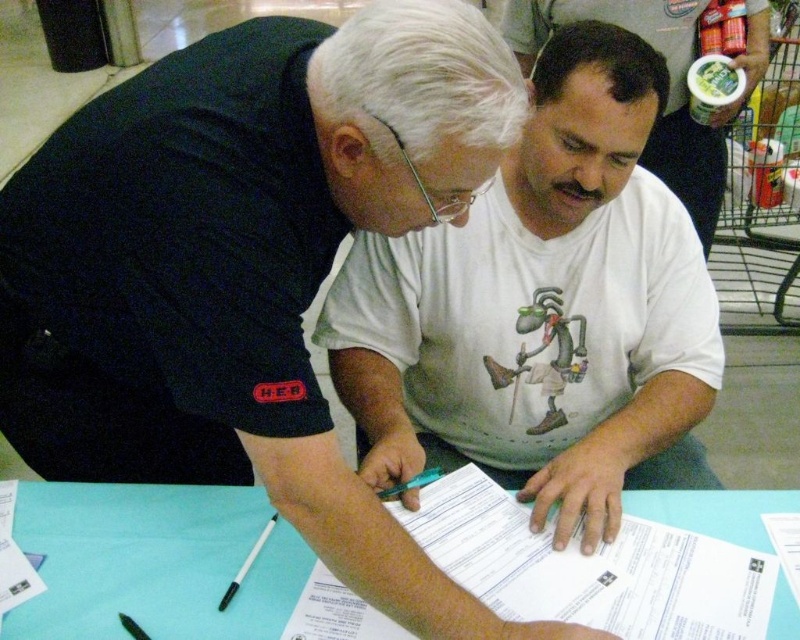
Question: Is white cotton shirt at center below light blue paper at center?

Choices:
 (A) yes
 (B) no

Answer: (B)

Question: Is white t-shirt at center closer to the viewer compared to black plastic pen at lower center?

Choices:
 (A) yes
 (B) no

Answer: (B)

Question: Which object is the farthest from the light blue paper at center?

Choices:
 (A) white cotton shirt at center
 (B) black plastic pen at lower center

Answer: (A)

Question: Which point is closer to the camera taking this photo?

Choices:
 (A) (492, 353)
 (B) (78, 550)

Answer: (B)

Question: Which object appears farthest from the camera in this image?

Choices:
 (A) light blue paper at center
 (B) white t-shirt at center
 (C) white cotton shirt at center

Answer: (B)

Question: Does white cotton shirt at center have a larger size compared to light blue paper at center?

Choices:
 (A) no
 (B) yes

Answer: (B)